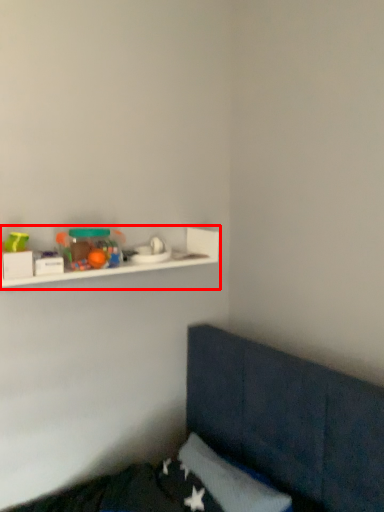
Question: In this image, where is shelf (annotated by the red box) located relative to toy?

Choices:
 (A) right
 (B) left

Answer: (A)